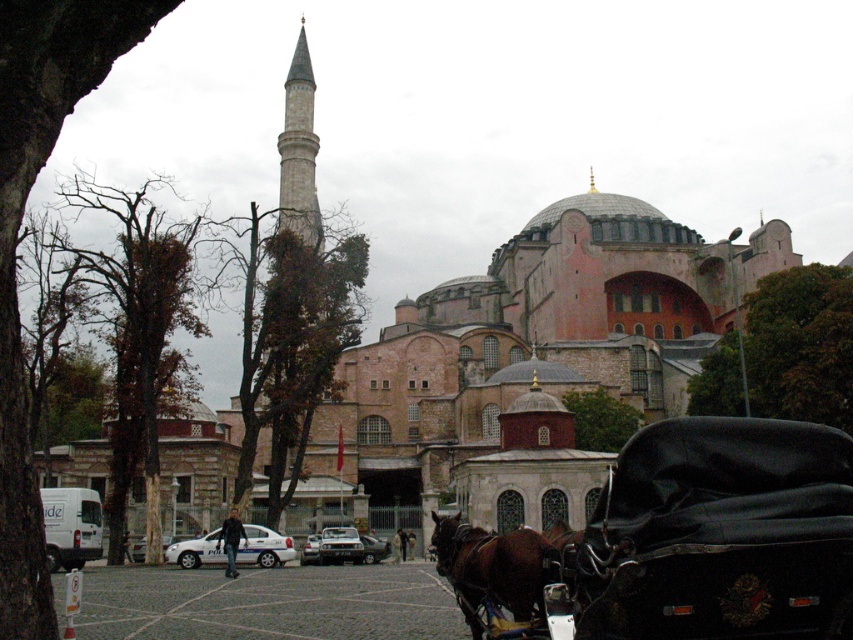
Does black leather horse cart at center have a lesser height compared to brown glossy horse at lower center?

In fact, black leather horse cart at center may be taller than brown glossy horse at lower center.

Does point (698, 499) come behind point (496, 570)?

No.

The height and width of the screenshot is (640, 853). What do you see at coordinates (717, 534) in the screenshot?
I see `black leather horse cart at center` at bounding box center [717, 534].

Identify the location of black leather horse cart at center. The height and width of the screenshot is (640, 853). (717, 534).

Which is more to the right, black leather horse cart at center or black leather coach at center?

From the viewer's perspective, black leather horse cart at center appears more on the right side.

Is black leather horse cart at center positioned before black leather coach at center?

Yes, black leather horse cart at center is in front of black leather coach at center.

The height and width of the screenshot is (640, 853). What do you see at coordinates (717, 534) in the screenshot?
I see `black leather horse cart at center` at bounding box center [717, 534].

In order to click on black leather horse cart at center in this screenshot , I will do `click(717, 534)`.

From the picture: Who is higher up, brown glossy horse at lower center or black leather coach at center?

brown glossy horse at lower center is higher up.

Does brown glossy horse at lower center lie in front of black leather coach at center?

Yes, it is in front of black leather coach at center.

Which is behind, point (480, 545) or point (219, 540)?

Point (219, 540)

Find the location of `brown glossy horse at lower center`. brown glossy horse at lower center is located at coordinates (495, 577).